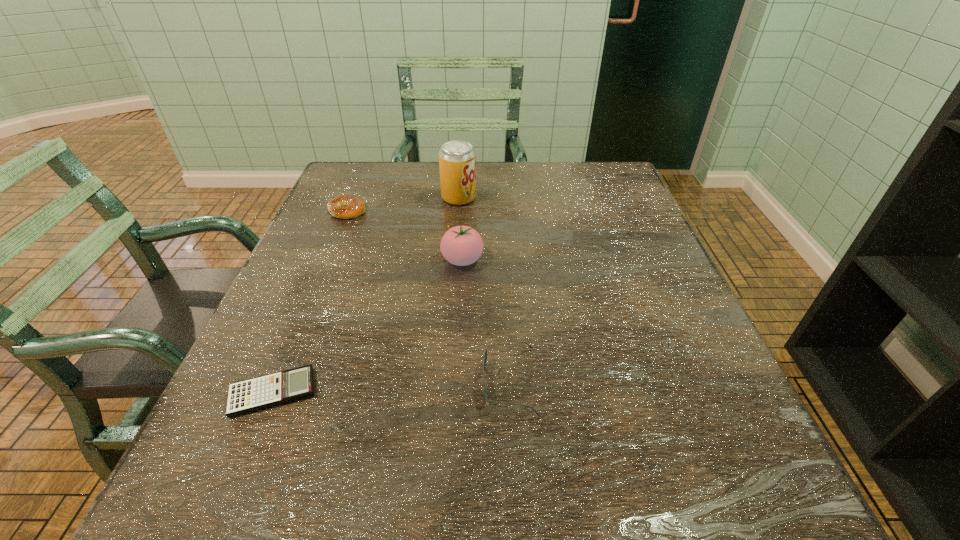
Where is `vacant space located 0.070m on the lenses of the third shortest object`? The height and width of the screenshot is (540, 960). vacant space located 0.070m on the lenses of the third shortest object is located at coordinates (440, 381).

What are the coordinates of `free space located on the right of the bagel` in the screenshot? It's located at (398, 211).

Identify the location of vacant space located on the right of the calculator. (536, 393).

Where is `pop (soda) that is at the far edge`? Image resolution: width=960 pixels, height=540 pixels. pop (soda) that is at the far edge is located at coordinates (457, 159).

Image resolution: width=960 pixels, height=540 pixels. In order to click on bagel that is at the far edge in this screenshot , I will do `click(346, 206)`.

Locate an element on the screen. This screenshot has width=960, height=540. bagel located at the left edge is located at coordinates (346, 206).

The image size is (960, 540). In order to click on calculator that is positioned at the left edge in this screenshot , I will do `click(246, 396)`.

The width and height of the screenshot is (960, 540). I want to click on object present at the far left corner, so click(x=346, y=206).

In the image, there is a desktop. At what (x,y) coordinates should I click in order to perform the action: click on vacant space at the far edge. Please return your answer as a coordinate pair (x, y). This screenshot has height=540, width=960. Looking at the image, I should click on click(x=559, y=166).

Find the location of a particular element. The height and width of the screenshot is (540, 960). vacant space at the near edge of the desktop is located at coordinates point(489,483).